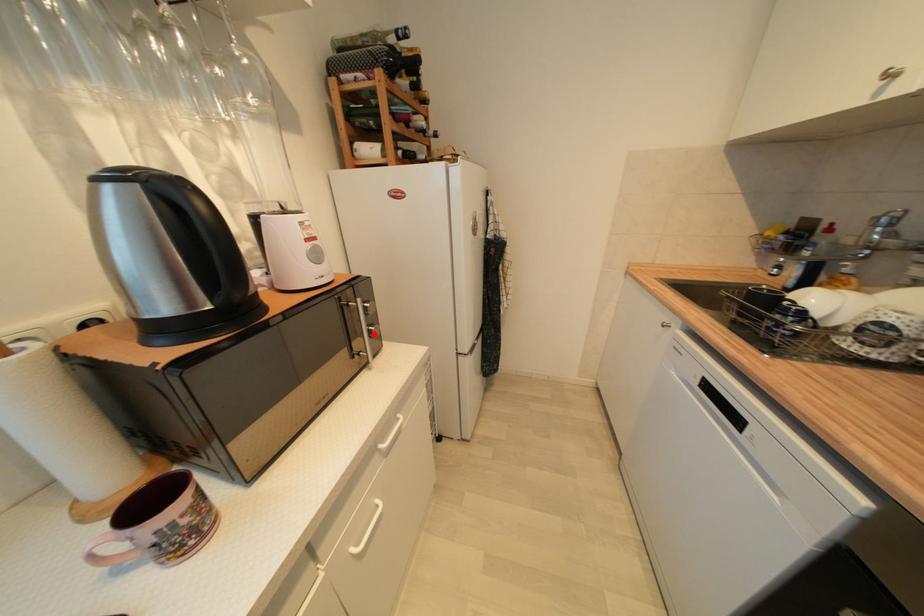
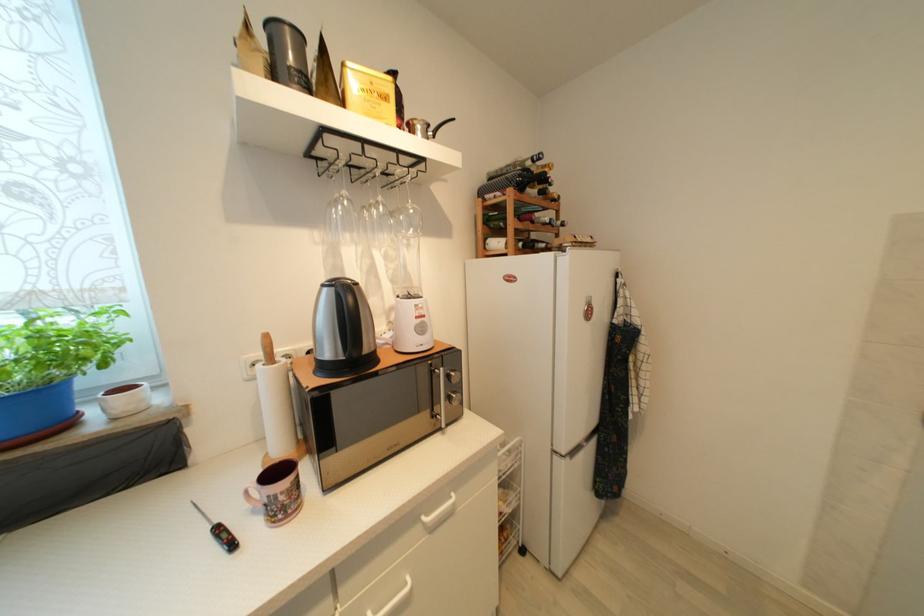
The point at the highlighted location is marked in the first image. Where is the corresponding point in the second image?

(455, 400)